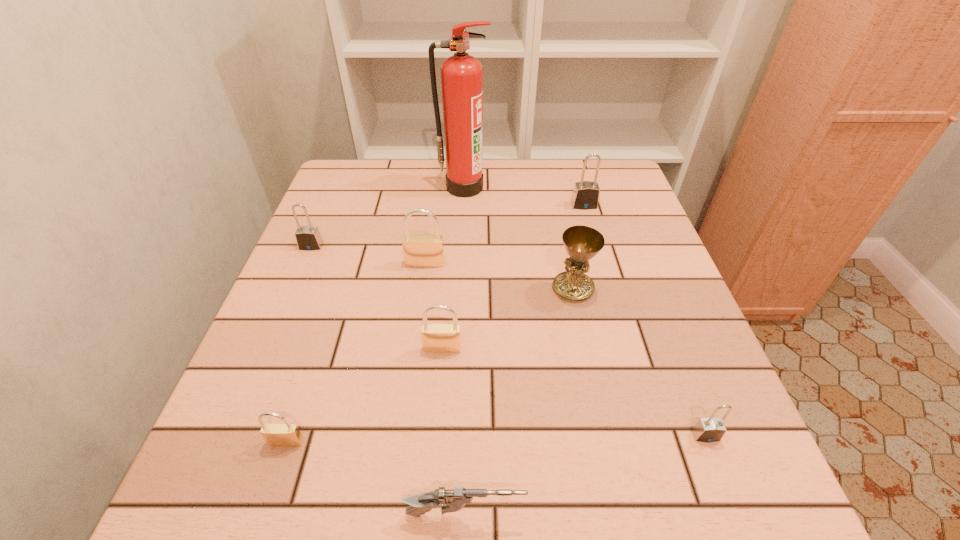
Identify the location of fire extinguisher. Image resolution: width=960 pixels, height=540 pixels. (461, 74).

Where is `the tallest object`? This screenshot has height=540, width=960. the tallest object is located at coordinates (461, 74).

This screenshot has height=540, width=960. In order to click on the second padlock from right to left in this screenshot , I will do `click(585, 196)`.

Where is `the biggest gray padlock`? This screenshot has width=960, height=540. the biggest gray padlock is located at coordinates (585, 196).

Locate an element on the screen. The height and width of the screenshot is (540, 960). the biggest brass padlock is located at coordinates (420, 250).

Find the location of a particular element. the farthest brass padlock is located at coordinates (420, 250).

I want to click on the fifth nearest object, so click(582, 243).

Identify the location of the second farthest gray padlock. The width and height of the screenshot is (960, 540). (308, 238).

Find the location of a particular element. The image size is (960, 540). the leftmost padlock is located at coordinates (308, 238).

This screenshot has width=960, height=540. Find the location of `the second biggest brass padlock`. the second biggest brass padlock is located at coordinates (437, 338).